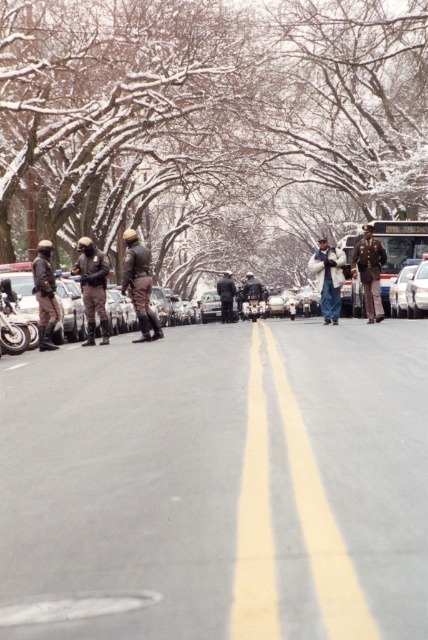
You are a pedestrian standing at the edge of the road. You see the matte black uniform at center and the shiny gold uniform at center. Which one is closer to you?

The matte black uniform at center is 7.72 meters from the shiny gold uniform at center, so the shiny gold uniform at center is closer to you.

From the picture: You are a pedestrian trying to cross the snowy street at the double yellow line. There is a white fuzzy coat at center. Where is the white fuzzy coat located relative to the double yellow line?

The white fuzzy coat at center is located at point 0.436 along the horizontal axis and 0.769 along the vertical axis relative to the double yellow line.